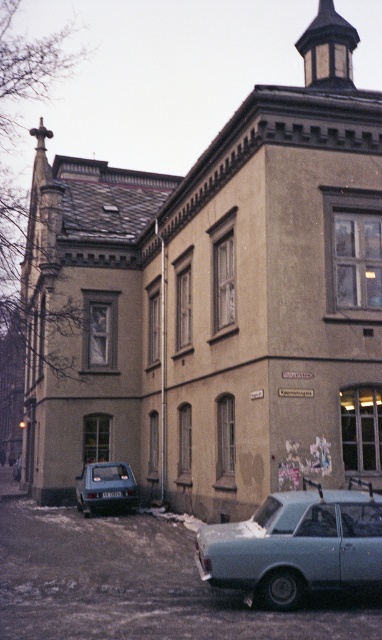
Is point (354, 544) in front of point (79, 492)?

Yes, point (354, 544) is in front of point (79, 492).

In order to click on light blue metallic car at lower right in this screenshot , I will do [296, 545].